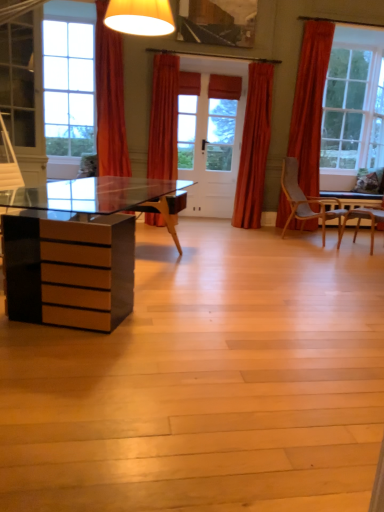
Question: From a real-world perspective, does orange fabric curtain at upper center, the 1th curtain in the left-to-right sequence, stand above velvet orange curtain at center, which is counted as the third curtain, starting from the left?

Choices:
 (A) no
 (B) yes

Answer: (B)

Question: Can you confirm if orange fabric curtain at upper center, the 1th curtain in the left-to-right sequence, is smaller than velvet orange curtain at center, the 1th curtain when ordered from right to left?

Choices:
 (A) no
 (B) yes

Answer: (A)

Question: Can you confirm if orange fabric curtain at upper center, the 1th curtain in the left-to-right sequence, is thinner than velvet orange curtain at center, the 1th curtain when ordered from right to left?

Choices:
 (A) yes
 (B) no

Answer: (B)

Question: Is orange fabric curtain at upper center, the 1th curtain in the left-to-right sequence, positioned far away from velvet orange curtain at center, which is counted as the third curtain, starting from the left?

Choices:
 (A) no
 (B) yes

Answer: (B)

Question: Is orange fabric curtain at upper center, the 1th curtain in the left-to-right sequence, shorter than velvet orange curtain at center, which is counted as the third curtain, starting from the left?

Choices:
 (A) no
 (B) yes

Answer: (A)

Question: Does point (264, 66) appear closer or farther from the camera than point (147, 218)?

Choices:
 (A) farther
 (B) closer

Answer: (A)

Question: Is velvet orange curtain at center, the 1th curtain when ordered from right to left, taller or shorter than orange fabric curtain at center, which ranks as the second curtain in left-to-right order?

Choices:
 (A) tall
 (B) short

Answer: (A)

Question: Relative to orange fabric curtain at center, which ranks as the second curtain in left-to-right order, is velvet orange curtain at center, which is counted as the third curtain, starting from the left, in front or behind?

Choices:
 (A) front
 (B) behind

Answer: (B)

Question: In terms of size, does velvet orange curtain at center, which is counted as the third curtain, starting from the left, appear bigger or smaller than orange fabric curtain at center, which ranks as the second curtain in left-to-right order?

Choices:
 (A) big
 (B) small

Answer: (B)

Question: Is orange fabric curtain at upper center, the 1th curtain in the left-to-right sequence, situated inside velvet orange curtain at center, the 1th curtain when ordered from right to left, or outside?

Choices:
 (A) inside
 (B) outside

Answer: (B)

Question: Is point (99, 96) positioned closer to the camera than point (261, 122)?

Choices:
 (A) closer
 (B) farther

Answer: (A)

Question: From a real-world perspective, is orange fabric curtain at upper center, the 1th curtain in the left-to-right sequence, positioned above or below velvet orange curtain at center, the 1th curtain when ordered from right to left?

Choices:
 (A) below
 (B) above

Answer: (B)

Question: Is orange fabric curtain at upper center, the 1th curtain in the left-to-right sequence, to the left or to the right of velvet orange curtain at center, which is counted as the third curtain, starting from the left, in the image?

Choices:
 (A) left
 (B) right

Answer: (A)

Question: Based on their sizes in the image, would you say orange fabric curtain at center, which ranks as the second curtain in left-to-right order, is bigger or smaller than orange fabric curtain at upper center, the 1th curtain in the left-to-right sequence?

Choices:
 (A) small
 (B) big

Answer: (A)

Question: Is orange fabric curtain at center, the second curtain from the right, taller or shorter than orange fabric curtain at upper center, which ranks as the 3th curtain in right-to-left order?

Choices:
 (A) tall
 (B) short

Answer: (B)